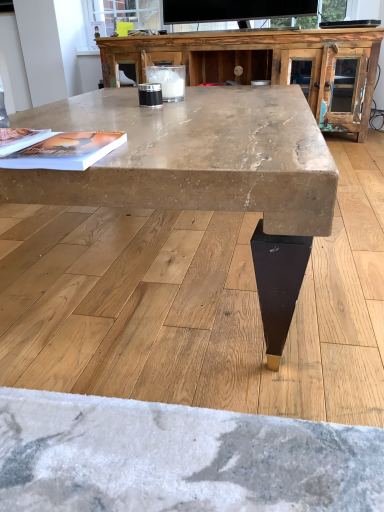
What do you see at coordinates (65, 151) in the screenshot? The image size is (384, 512). I see `matte paper magazine at center, the 2th magazine in the left-to-right sequence` at bounding box center [65, 151].

This screenshot has height=512, width=384. What do you see at coordinates (259, 62) in the screenshot?
I see `rustic wood entertainment center at upper center` at bounding box center [259, 62].

The width and height of the screenshot is (384, 512). Describe the element at coordinates (199, 155) in the screenshot. I see `marble-like wood coffee table at center` at that location.

This screenshot has width=384, height=512. Describe the element at coordinates (20, 139) in the screenshot. I see `matte paper magazine at upper left, placed as the first magazine when sorted from left to right` at that location.

In order to click on matte paper magazine at center, the 2th magazine in the left-to-right sequence in this screenshot , I will do coord(65,151).

Which is in front, point (237, 185) or point (16, 146)?

Point (237, 185)

Considering the relative sizes of marble-like wood coffee table at center and matte paper magazine at upper left, placed as the first magazine when sorted from left to right, in the image provided, is marble-like wood coffee table at center wider than matte paper magazine at upper left, placed as the first magazine when sorted from left to right,?

Indeed, marble-like wood coffee table at center has a greater width compared to matte paper magazine at upper left, placed as the first magazine when sorted from left to right.

Can we say marble-like wood coffee table at center lies outside matte paper magazine at upper left, placed as the first magazine when sorted from left to right?

Indeed, marble-like wood coffee table at center is completely outside matte paper magazine at upper left, placed as the first magazine when sorted from left to right.

Is rustic wood entertainment center at upper center aimed at matte paper magazine at center, the 2th magazine in the left-to-right sequence?

Yes, rustic wood entertainment center at upper center is oriented towards matte paper magazine at center, the 2th magazine in the left-to-right sequence.

From the image's perspective, which one is positioned lower, rustic wood entertainment center at upper center or matte paper magazine at center, the 2th magazine in the left-to-right sequence?

matte paper magazine at center, the 2th magazine in the left-to-right sequence, is shown below in the image.

Do you think rustic wood entertainment center at upper center is within matte paper magazine at center, the 2th magazine in the left-to-right sequence, or outside of it?

rustic wood entertainment center at upper center cannot be found inside matte paper magazine at center, the 2th magazine in the left-to-right sequence.

Can you confirm if rustic wood entertainment center at upper center is shorter than matte paper magazine at center, the 2th magazine in the left-to-right sequence?

Incorrect, the height of rustic wood entertainment center at upper center does not fall short of that of matte paper magazine at center, the 2th magazine in the left-to-right sequence.

Can you tell me how much marble-like wood coffee table at center and rustic wood entertainment center at upper center differ in facing direction?

The facing directions of marble-like wood coffee table at center and rustic wood entertainment center at upper center are 87.7 degrees apart.

Measure the distance between marble-like wood coffee table at center and rustic wood entertainment center at upper center.

They are 1.53 meters apart.

Would you say marble-like wood coffee table at center is to the left or to the right of rustic wood entertainment center at upper center in the picture?

Clearly, marble-like wood coffee table at center is on the left of rustic wood entertainment center at upper center in the image.

From the picture: From the image's perspective, which is above, marble-like wood coffee table at center or rustic wood entertainment center at upper center?

rustic wood entertainment center at upper center, from the image's perspective.

Is marble-like wood coffee table at center at the right side of matte paper magazine at center, the 2th magazine in the left-to-right sequence?

Indeed, marble-like wood coffee table at center is positioned on the right side of matte paper magazine at center, the 2th magazine in the left-to-right sequence.

Looking at this image, does marble-like wood coffee table at center have a smaller size compared to matte paper magazine at center, the 2th magazine in the left-to-right sequence?

Actually, marble-like wood coffee table at center might be larger than matte paper magazine at center, the 2th magazine in the left-to-right sequence.

Is marble-like wood coffee table at center directly adjacent to matte paper magazine at center, the 2th magazine in the left-to-right sequence?

marble-like wood coffee table at center and matte paper magazine at center, the 2th magazine in the left-to-right sequence, are clearly separated.

Is matte paper magazine at upper left, which is the second magazine from right to left, situated inside matte paper magazine at center, which appears as the 1th magazine when viewed from the right, or outside?

matte paper magazine at upper left, which is the second magazine from right to left, exists outside the volume of matte paper magazine at center, which appears as the 1th magazine when viewed from the right.

From the image's perspective, between matte paper magazine at upper left, which is the second magazine from right to left, and matte paper magazine at center, the 2th magazine in the left-to-right sequence, who is located below?

matte paper magazine at center, the 2th magazine in the left-to-right sequence, from the image's perspective.

Between matte paper magazine at upper left, which is the second magazine from right to left, and matte paper magazine at center, the 2th magazine in the left-to-right sequence, which one is positioned in front?

matte paper magazine at center, the 2th magazine in the left-to-right sequence.

Considering the relative sizes of matte paper magazine at upper left, placed as the first magazine when sorted from left to right, and matte paper magazine at center, which appears as the 1th magazine when viewed from the right, in the image provided, is matte paper magazine at upper left, placed as the first magazine when sorted from left to right, taller than matte paper magazine at center, which appears as the 1th magazine when viewed from the right,?

Incorrect, the height of matte paper magazine at upper left, placed as the first magazine when sorted from left to right, is not larger of that of matte paper magazine at center, which appears as the 1th magazine when viewed from the right.

From a real-world perspective, is matte paper magazine at center, the 2th magazine in the left-to-right sequence, under matte paper magazine at upper left, which is the second magazine from right to left?

Correct, in the physical world, matte paper magazine at center, the 2th magazine in the left-to-right sequence, is lower than matte paper magazine at upper left, which is the second magazine from right to left.

Considering the sizes of matte paper magazine at center, which appears as the 1th magazine when viewed from the right, and matte paper magazine at upper left, placed as the first magazine when sorted from left to right, in the image, is matte paper magazine at center, which appears as the 1th magazine when viewed from the right, bigger or smaller than matte paper magazine at upper left, placed as the first magazine when sorted from left to right,?

Considering their sizes, matte paper magazine at center, which appears as the 1th magazine when viewed from the right, takes up less space than matte paper magazine at upper left, placed as the first magazine when sorted from left to right.

Where is `magazine that appears below the matte paper magazine at upper left, which is the second magazine from right to left (from the image's perspective)`? This screenshot has width=384, height=512. magazine that appears below the matte paper magazine at upper left, which is the second magazine from right to left (from the image's perspective) is located at coordinates (65, 151).

Is matte paper magazine at center, which appears as the 1th magazine when viewed from the right, oriented away from matte paper magazine at upper left, which is the second magazine from right to left?

No.

Does rustic wood entertainment center at upper center have a lesser height compared to matte paper magazine at upper left, which is the second magazine from right to left?

In fact, rustic wood entertainment center at upper center may be taller than matte paper magazine at upper left, which is the second magazine from right to left.

Based on the photo, from a real-world perspective, between rustic wood entertainment center at upper center and matte paper magazine at upper left, which is the second magazine from right to left, who is vertically higher?

matte paper magazine at upper left, which is the second magazine from right to left, is physically above.

Is rustic wood entertainment center at upper center positioned with its back to matte paper magazine at upper left, which is the second magazine from right to left?

No, rustic wood entertainment center at upper center's orientation is not away from matte paper magazine at upper left, which is the second magazine from right to left.

Where is `magazine that is the 2nd object located behind the marble-like wood coffee table at center`? This screenshot has height=512, width=384. magazine that is the 2nd object located behind the marble-like wood coffee table at center is located at coordinates click(20, 139).

At what (x,y) coordinates should I click in order to perform the action: click on entertainment center on the right side of matte paper magazine at center, which appears as the 1th magazine when viewed from the right. Please return your answer as a coordinate pair (x, y). The image size is (384, 512). Looking at the image, I should click on (259, 62).

From the image, which object appears to be farther from matte paper magazine at center, the 2th magazine in the left-to-right sequence, matte paper magazine at upper left, which is the second magazine from right to left, or rustic wood entertainment center at upper center?

rustic wood entertainment center at upper center lies further to matte paper magazine at center, the 2th magazine in the left-to-right sequence, than the other object.

Considering their positions, is marble-like wood coffee table at center positioned further to matte paper magazine at center, the 2th magazine in the left-to-right sequence, than matte paper magazine at upper left, which is the second magazine from right to left?

marble-like wood coffee table at center is further to matte paper magazine at center, the 2th magazine in the left-to-right sequence.

Considering their positions, is marble-like wood coffee table at center positioned further to matte paper magazine at center, the 2th magazine in the left-to-right sequence, than rustic wood entertainment center at upper center?

rustic wood entertainment center at upper center is further to matte paper magazine at center, the 2th magazine in the left-to-right sequence.

Estimate the real-world distances between objects in this image. Which object is further from rustic wood entertainment center at upper center, matte paper magazine at center, which appears as the 1th magazine when viewed from the right, or matte paper magazine at upper left, which is the second magazine from right to left?

The object further to rustic wood entertainment center at upper center is matte paper magazine at upper left, which is the second magazine from right to left.

Considering their positions, is matte paper magazine at center, which appears as the 1th magazine when viewed from the right, positioned closer to marble-like wood coffee table at center than rustic wood entertainment center at upper center?

matte paper magazine at center, which appears as the 1th magazine when viewed from the right, is positioned closer to the anchor marble-like wood coffee table at center.

When comparing their distances from marble-like wood coffee table at center, does matte paper magazine at upper left, placed as the first magazine when sorted from left to right, or rustic wood entertainment center at upper center seem further?

The object further to marble-like wood coffee table at center is rustic wood entertainment center at upper center.

Looking at the image, which one is located closer to matte paper magazine at upper left, placed as the first magazine when sorted from left to right, marble-like wood coffee table at center or rustic wood entertainment center at upper center?

Among the two, marble-like wood coffee table at center is located nearer to matte paper magazine at upper left, placed as the first magazine when sorted from left to right.

When comparing their distances from rustic wood entertainment center at upper center, does marble-like wood coffee table at center or matte paper magazine at center, the 2th magazine in the left-to-right sequence, seem further?

matte paper magazine at center, the 2th magazine in the left-to-right sequence, lies further to rustic wood entertainment center at upper center than the other object.

Where is `magazine positioned between matte paper magazine at center, which appears as the 1th magazine when viewed from the right, and rustic wood entertainment center at upper center from near to far`? The width and height of the screenshot is (384, 512). magazine positioned between matte paper magazine at center, which appears as the 1th magazine when viewed from the right, and rustic wood entertainment center at upper center from near to far is located at coordinates (20, 139).

At what (x,y) coordinates should I click in order to perform the action: click on magazine between matte paper magazine at upper left, placed as the first magazine when sorted from left to right, and marble-like wood coffee table at center, in the horizontal direction. Please return your answer as a coordinate pair (x, y). This screenshot has height=512, width=384. Looking at the image, I should click on (65, 151).